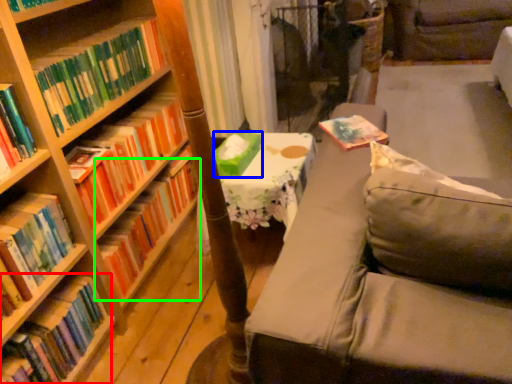
Question: Based on their relative distances, which object is farther from book (highlighted by a red box)? Choose from paperback book (highlighted by a blue box) and book (highlighted by a green box).

Choices:
 (A) paperback book
 (B) book

Answer: (A)